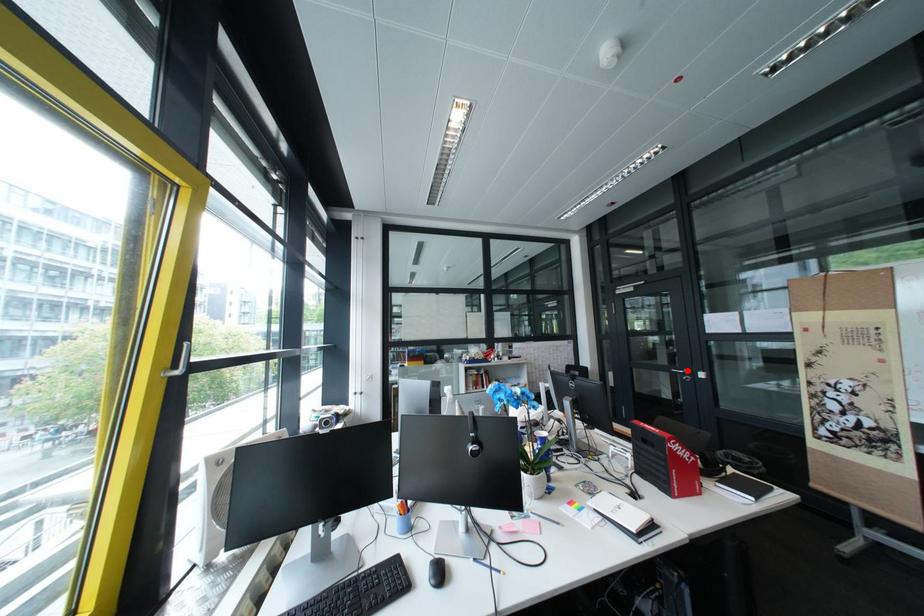
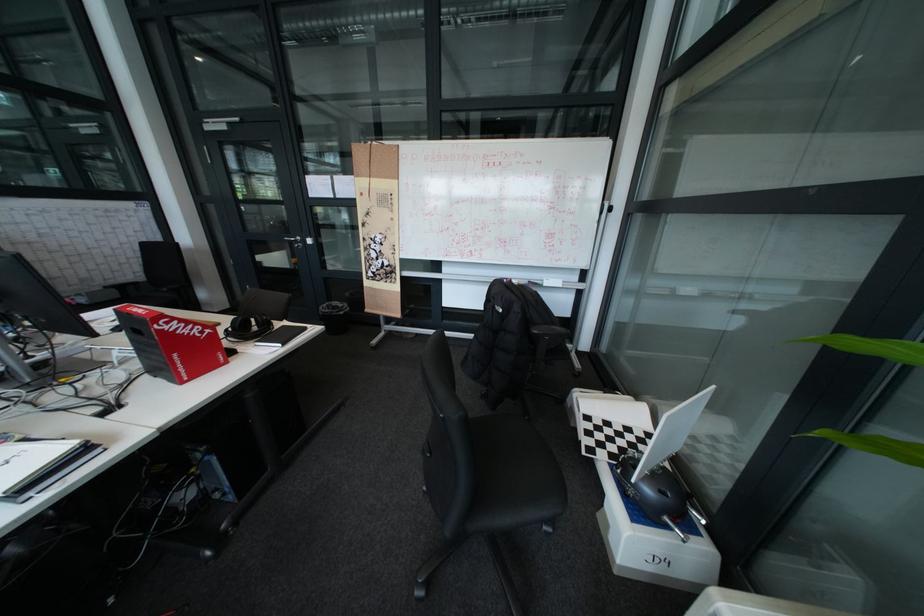
Question: I am providing you with two images of the same scene from different viewpoints. A red point is shown in image1. For the corresponding object point in image2, is it positioned nearer or farther from the camera?

Choices:
 (A) Nearer
 (B) Farther

Answer: (B)